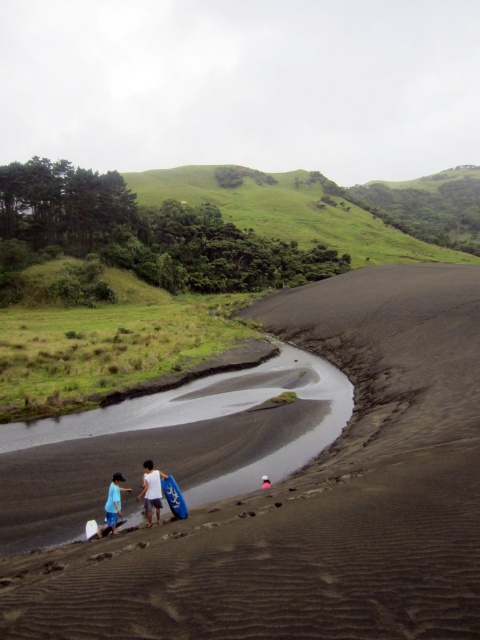
Between black sand beach at lower center and black sand river at lower center, which one has more height?

black sand beach at lower center is taller.

Which is more to the right, black sand beach at lower center or black sand river at lower center?

Positioned to the right is black sand beach at lower center.

Does point (444, 422) come closer to viewer compared to point (224, 422)?

Yes, point (444, 422) is closer to viewer.

This screenshot has width=480, height=640. In order to click on black sand beach at lower center in this screenshot , I will do `click(314, 497)`.

Is blue matte surfboard at lower center above blue foam surfboard at lower left?

Correct, blue matte surfboard at lower center is located above blue foam surfboard at lower left.

At what (x,y) coordinates should I click in order to perform the action: click on blue matte surfboard at lower center. Please return your answer as a coordinate pair (x, y). This screenshot has width=480, height=640. Looking at the image, I should click on (173, 497).

Which is more to the right, white matte surfboard at lower center or pink fabric at center?

From the viewer's perspective, pink fabric at center appears more on the right side.

I want to click on white matte surfboard at lower center, so click(x=152, y=490).

Find the location of a particular element. The image size is (480, 640). white matte surfboard at lower center is located at coordinates (152, 490).